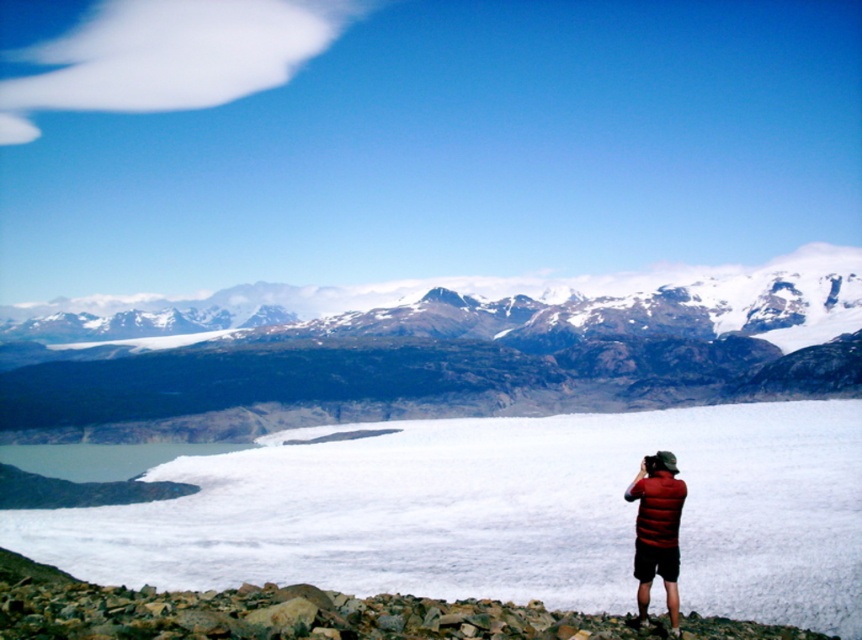
Question: Which point appears closest to the camera in this image?

Choices:
 (A) (675, 522)
 (B) (225, 428)

Answer: (A)

Question: Which object is closer to the camera taking this photo?

Choices:
 (A) white matte snow at center
 (B) sandy brown rock formation at center
 (C) matte red vest at lower right

Answer: (C)

Question: Can you confirm if white matte snow at center is positioned to the left of matte red vest at lower right?

Choices:
 (A) yes
 (B) no

Answer: (A)

Question: Which of these objects is positioned closest to the matte red vest at lower right?

Choices:
 (A) white matte snow at center
 (B) sandy brown rock formation at center

Answer: (A)

Question: Can you confirm if white matte snow at center is positioned to the left of matte red vest at lower right?

Choices:
 (A) yes
 (B) no

Answer: (A)

Question: Can you confirm if sandy brown rock formation at center is smaller than matte red vest at lower right?

Choices:
 (A) yes
 (B) no

Answer: (B)